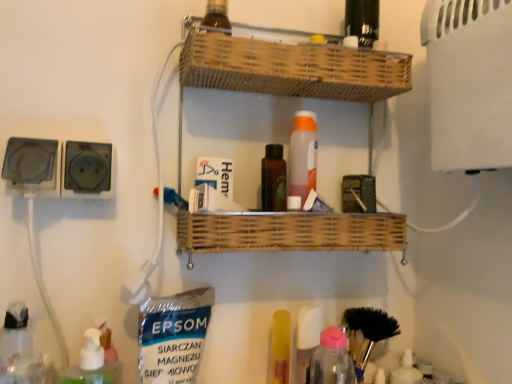
Question: Is brown glass bottle at upper center turned away from black plastic socket at left, acting as the 1th electric outlet starting from the left?

Choices:
 (A) no
 (B) yes

Answer: (A)

Question: Would you say black plastic socket at left, acting as the 1th electric outlet starting from the left, is part of brown glass bottle at upper center's contents?

Choices:
 (A) no
 (B) yes

Answer: (A)

Question: From a real-world perspective, is brown glass bottle at upper center physically above black plastic socket at left, positioned as the 2th electric outlet in right-to-left order?

Choices:
 (A) no
 (B) yes

Answer: (B)

Question: Can you confirm if brown glass bottle at upper center is taller than black plastic socket at left, acting as the 1th electric outlet starting from the left?

Choices:
 (A) yes
 (B) no

Answer: (B)

Question: Does brown glass bottle at upper center lie behind black plastic socket at left, positioned as the 2th electric outlet in right-to-left order?

Choices:
 (A) yes
 (B) no

Answer: (A)

Question: Does point (209, 51) appear closer or farther from the camera than point (378, 314)?

Choices:
 (A) farther
 (B) closer

Answer: (B)

Question: From a real-world perspective, is woven wood shelf at center physically located above or below black bristle brush at lower right?

Choices:
 (A) above
 (B) below

Answer: (A)

Question: Is woven wood shelf at center bigger or smaller than black bristle brush at lower right?

Choices:
 (A) big
 (B) small

Answer: (A)

Question: Is woven wood shelf at center taller or shorter than black bristle brush at lower right?

Choices:
 (A) tall
 (B) short

Answer: (A)

Question: Based on their sizes in the image, would you say brown glass bottle at upper center is bigger or smaller than yellow plastic tube at lower center?

Choices:
 (A) big
 (B) small

Answer: (B)

Question: From a real-world perspective, is brown glass bottle at upper center positioned above or below yellow plastic tube at lower center?

Choices:
 (A) above
 (B) below

Answer: (A)

Question: Is brown glass bottle at upper center inside the boundaries of yellow plastic tube at lower center, or outside?

Choices:
 (A) outside
 (B) inside

Answer: (A)

Question: Considering the positions of brown glass bottle at upper center and yellow plastic tube at lower center in the image, is brown glass bottle at upper center taller or shorter than yellow plastic tube at lower center?

Choices:
 (A) short
 (B) tall

Answer: (A)

Question: Is black plastic socket at left, positioned as the 2th electric outlet in right-to-left order, inside the boundaries of brown glass bottle at upper center, or outside?

Choices:
 (A) outside
 (B) inside

Answer: (A)

Question: Looking at the image, does black plastic socket at left, acting as the 1th electric outlet starting from the left, seem bigger or smaller compared to brown glass bottle at upper center?

Choices:
 (A) big
 (B) small

Answer: (A)